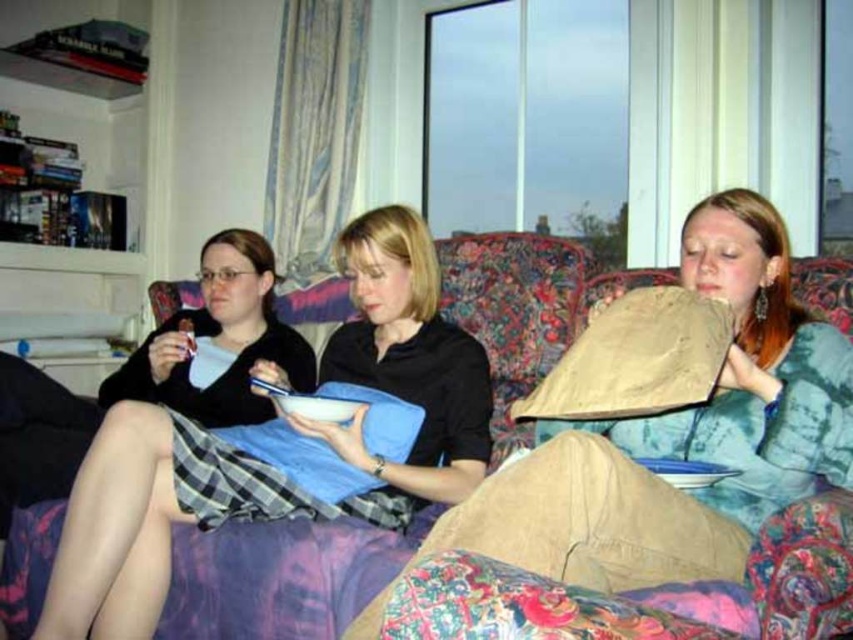
Between floral fabric couch at center and white matte bowl at center, which one has more height?

With more height is floral fabric couch at center.

Is floral fabric couch at center wider than white matte bowl at center?

Correct, the width of floral fabric couch at center exceeds that of white matte bowl at center.

Is point (535, 300) positioned after point (187, 317)?

No, (535, 300) is closer to viewer.

At what (x,y) coordinates should I click in order to perform the action: click on floral fabric couch at center. Please return your answer as a coordinate pair (x, y). This screenshot has height=640, width=853. Looking at the image, I should click on (279, 577).